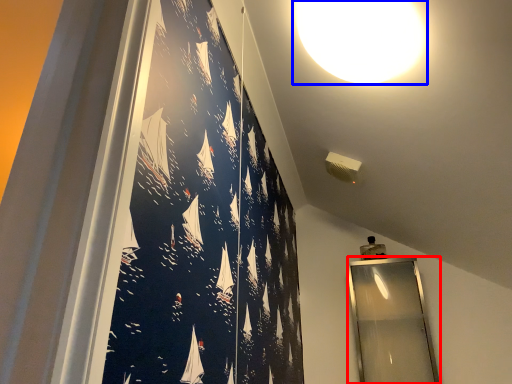
Question: Which point is closer to the camera, mirror (highlighted by a red box) or lamp (highlighted by a blue box)?

Choices:
 (A) mirror
 (B) lamp

Answer: (B)